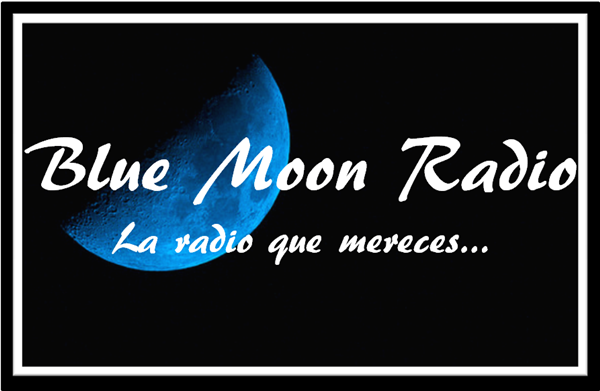
At what (x,y) coordinates should I click in order to perform the action: click on word radio. Please return your answer as a coordinate pair (x, y). Image resolution: width=600 pixels, height=391 pixels. Looking at the image, I should click on (463, 174).